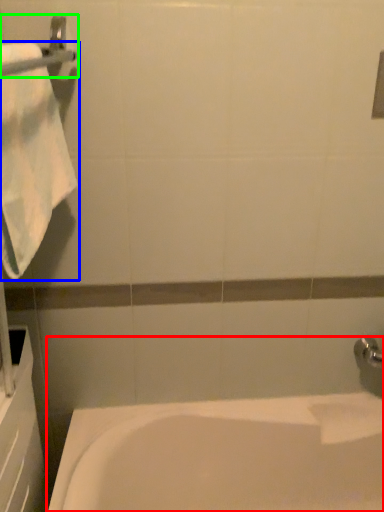
Question: Which is nearer to the bathtub (highlighted by a red box)? towel (highlighted by a blue box) or towel bar (highlighted by a green box).

Choices:
 (A) towel
 (B) towel bar

Answer: (A)